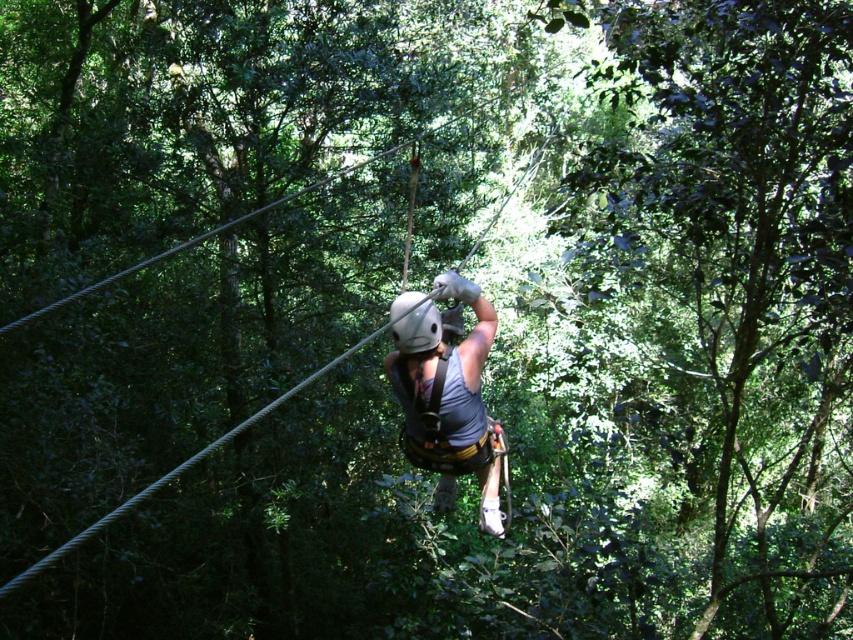
You are a safety inspector checking the zipline setup. You notice the green leafy tree at center and the gray fabric harness at center. Based on their positions, is there a risk of the harness getting entangled with the tree during the zipline ride?

The green leafy tree at center is positioned over the gray fabric harness at center. This means the tree is above the harness, so there is a risk of the harness getting entangled with the tree during the zipline ride.

Consider the image. You are a park ranger assessing safety for the zipline. The green leafy tree at center and the gray fabric harness at center are both visible from your vantage point. Which object appears taller in the image?

The green leafy tree at center appears taller than the gray fabric harness at center because the description states that the green leafy tree at center has a greater height compared to the gray fabric harness at center.